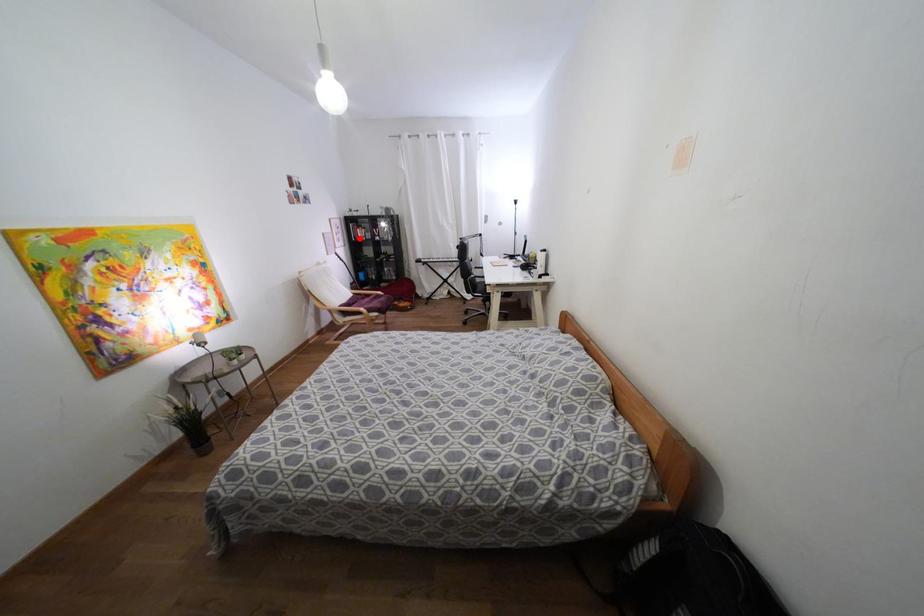
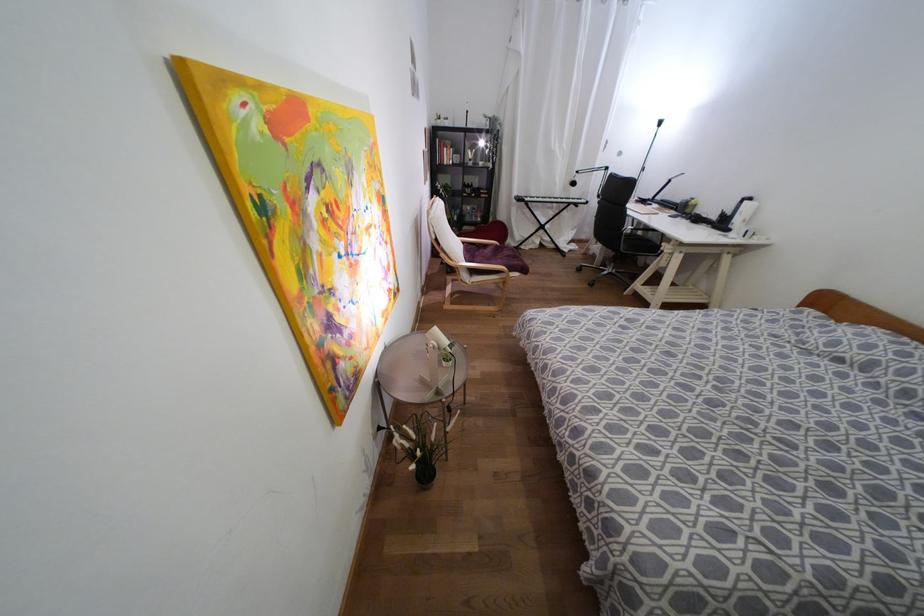
Find the pixel in the second image that matches the highlighted location in the first image.

(444, 161)